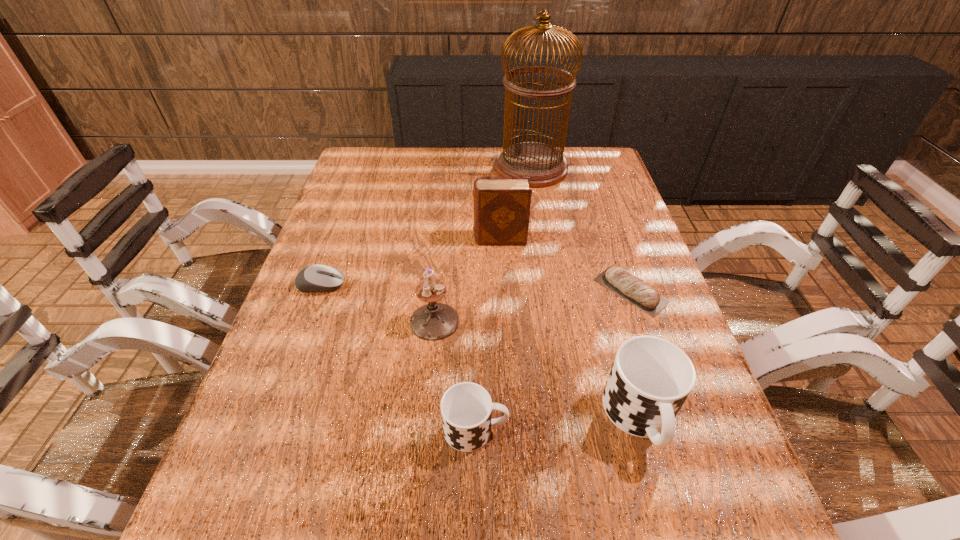
Please show where to add a cup on the left while keeping spacing even. Please provide its 2D coordinates. Your answer should be formatted as a tuple, i.e. [(x, y)], where the tuple contains the x and y coordinates of a point satisfying the conditions above.

[(303, 442)]